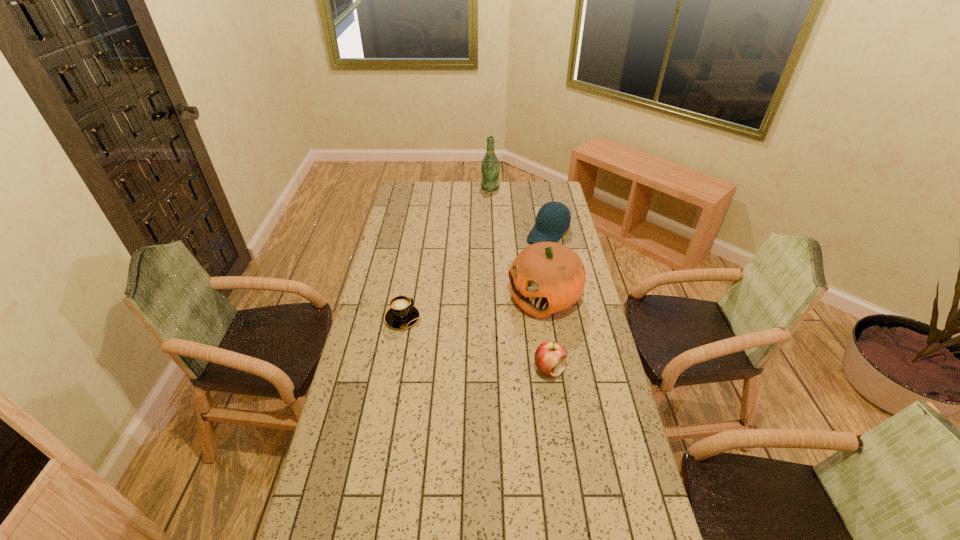
You are a GUI agent. You are given a task and a screenshot of the screen. Output one action in this format:
    pyautogui.click(x=<x>, y=<y>)
    Task: Click on the free space on the desktop that is between the shortest object and the fourth tallest object and is positioned on the face of the second tallest object
    Image resolution: width=960 pixels, height=540 pixels.
    Given the screenshot: What is the action you would take?
    point(468,341)

What are the coordinates of `vacant space on the desktop that is between the leftmost object and the apple and is positioned on the surface of the tallest object` in the screenshot? It's located at (451, 335).

Find the location of `free space on the desktop that is between the leftmost object and the apple and is positioned on the front-facing side of the third tallest object`. free space on the desktop that is between the leftmost object and the apple and is positioned on the front-facing side of the third tallest object is located at coordinates (452, 335).